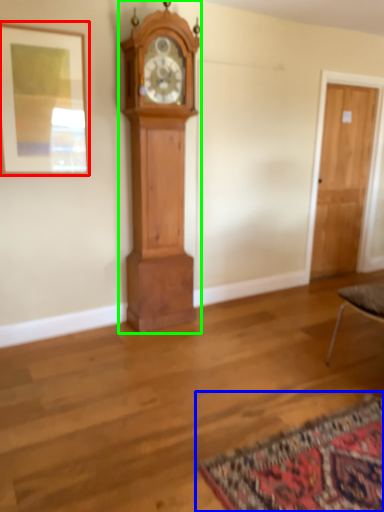
Question: Which object is positioned closest to picture frame (highlighted by a red box)? Select from mat (highlighted by a blue box) and wall clock (highlighted by a green box).

Choices:
 (A) mat
 (B) wall clock

Answer: (B)